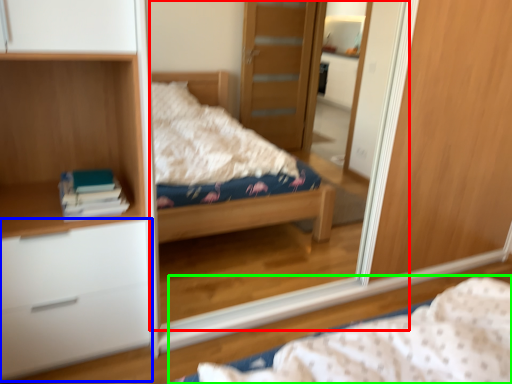
Question: Based on their relative distances, which object is nearer to mirror (highlighted by a red box)? Choose from chest of drawers (highlighted by a blue box) and bed (highlighted by a green box).

Choices:
 (A) chest of drawers
 (B) bed

Answer: (A)